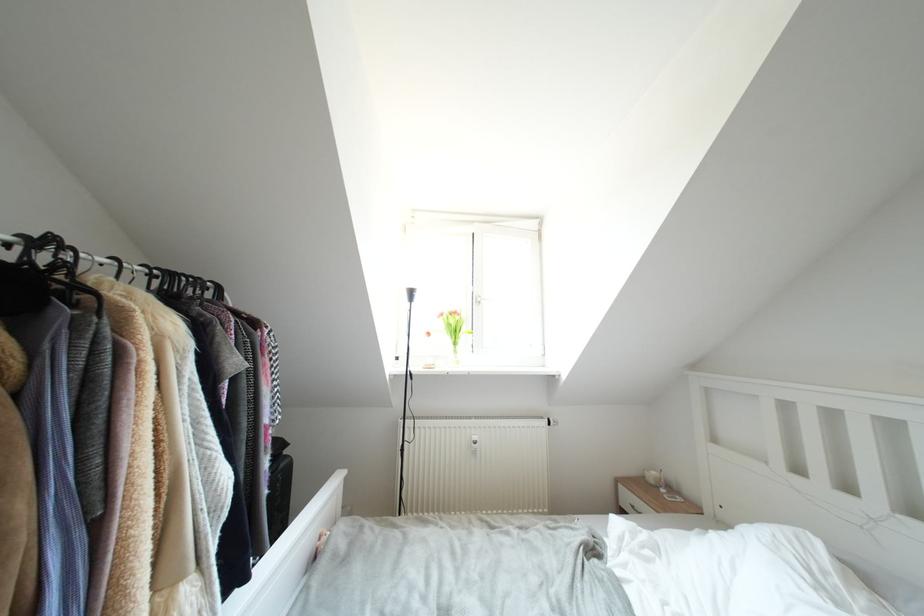
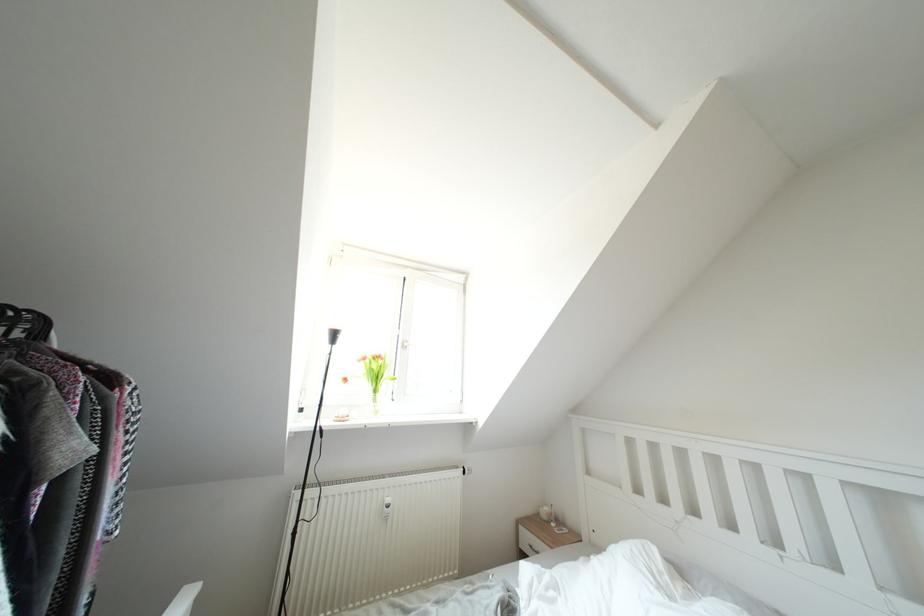
Locate, in the second image, the point that corresponds to the point at 447,318 in the first image.

(370, 363)